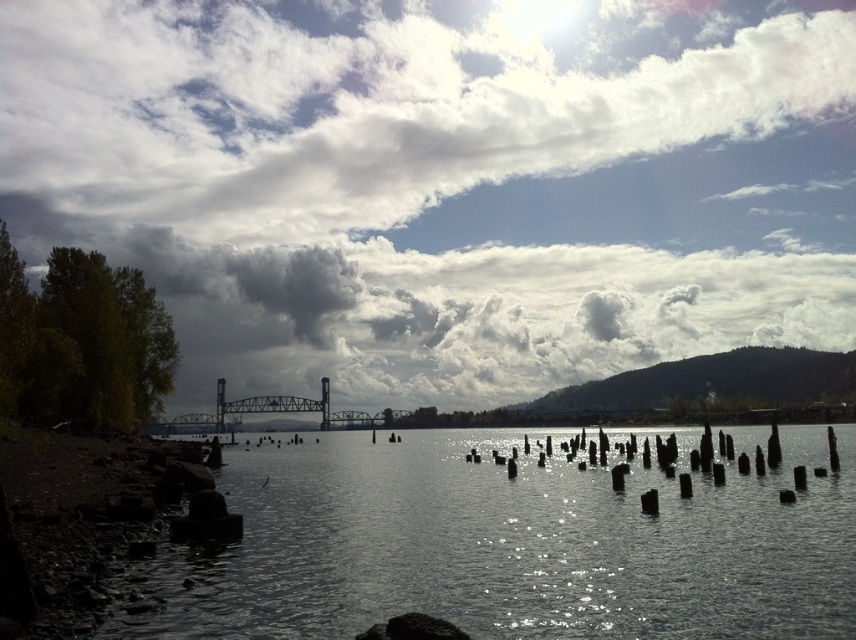
You are standing on the riverside and looking at the cloudy sky at center and the black metal pole at center. Which one is higher in the scene?

The cloudy sky at center is above the black metal pole at center, so it is higher.

You are standing on the riverside and want to cross the river to the other side. You see the dark gray water at center and the black metal pole at center. Which object is higher from the ground?

The dark gray water at center is above the black metal pole at center, so the dark gray water at center is higher from the ground.